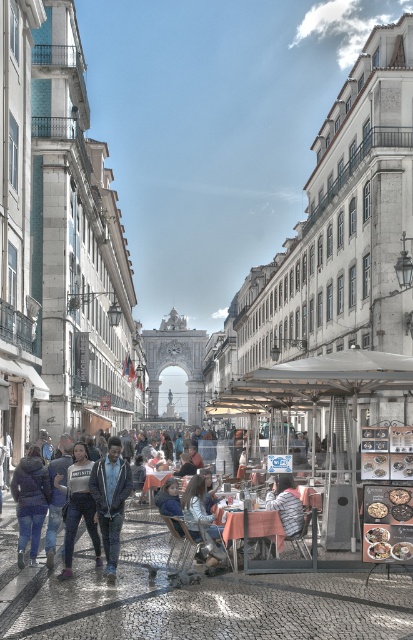
Between white cotton crop top at center and golden crispy pastry at center, which one appears on the right side from the viewer's perspective?

golden crispy pastry at center

Is the position of white cotton crop top at center less distant than that of golden crispy pastry at center?

No, white cotton crop top at center is behind golden crispy pastry at center.

Who is more distant from viewer, (x=78, y=486) or (x=393, y=499)?

Positioned behind is point (x=78, y=486).

This screenshot has width=413, height=640. I want to click on white cotton crop top at center, so [78, 506].

Between orange tablecloth at center and golden crispy pastry at center, which one is positioned lower?

orange tablecloth at center

Is point (282, 538) farther from camera compared to point (389, 496)?

Yes, it is behind point (389, 496).

Describe the element at coordinates (266, 525) in the screenshot. The height and width of the screenshot is (640, 413). I see `orange tablecloth at center` at that location.

Locate an element on the screen. This screenshot has height=640, width=413. orange tablecloth at center is located at coordinates (266, 525).

Can you confirm if orange fabric table at center is shorter than smooth chocolate bar at center?

Indeed, orange fabric table at center has a lesser height compared to smooth chocolate bar at center.

Between orange fabric table at center and smooth chocolate bar at center, which one is positioned higher?

smooth chocolate bar at center is higher up.

Locate an element on the screen. This screenshot has width=413, height=640. orange fabric table at center is located at coordinates (154, 483).

At what (x,y) coordinates should I click in order to perform the action: click on orange fabric table at center. Please return your answer as a coordinate pair (x, y). Looking at the image, I should click on (154, 483).